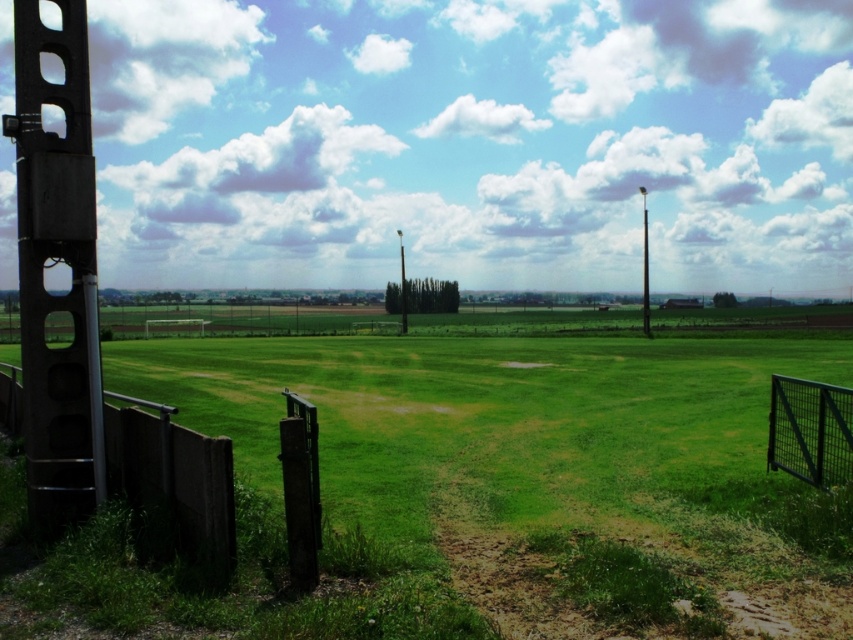
You are a farmer checking the boundaries of your property. You see the dark gray concrete fence at lower left and the smooth metal pole at right. Which object is closer to you?

The dark gray concrete fence at lower left is smaller than the smooth metal pole at right, so it is closer to you.

You are standing at the center of the field in the image. You want to walk towards the dark gray concrete fence at lower left. Which direction should you head?

Since the dark gray concrete fence at lower left is located at point 0.748 on the x axis and 0.206 on the y axis, you should head towards the lower left direction to reach it.

You are a gardener who needs to mow the lawn. You see the green grass at center and the smooth metal pole at right. Which area should you mow first if you want to start from the shorter vegetation?

The green grass at center is not as tall as the smooth metal pole at right, so you should mow the green grass at center first since it is shorter.